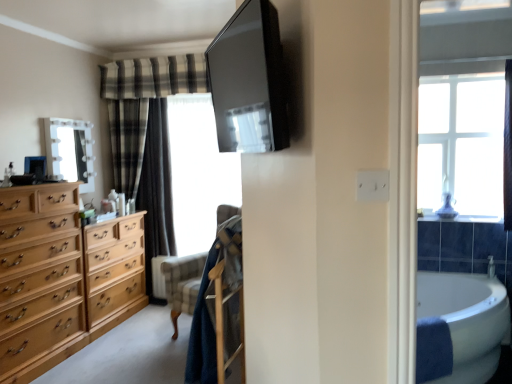
Question: From the image's perspective, is white glossy bathtub at lower right located above or below light brown wood dresser at left?

Choices:
 (A) below
 (B) above

Answer: (A)

Question: Considering the relative positions of white glossy bathtub at lower right and light brown wood dresser at left in the image provided, is white glossy bathtub at lower right to the left or to the right of light brown wood dresser at left?

Choices:
 (A) left
 (B) right

Answer: (B)

Question: Estimate the real-world distances between objects in this image. Which object is closer to the white glossy mirror at upper left?

Choices:
 (A) transparent plastic window screen at center
 (B) plaid fabric curtain at left
 (C) white glossy bathtub at lower right
 (D) light brown wood chest of drawers at left
 (E) light brown wood dresser at left

Answer: (B)

Question: Based on their relative distances, which object is farther from the white glossy bathtub at lower right?

Choices:
 (A) transparent plastic window screen at center
 (B) white glossy mirror at upper left
 (C) velvet-like beige armchair at center
 (D) light brown wood dresser at left
 (E) plaid fabric curtain at left

Answer: (B)